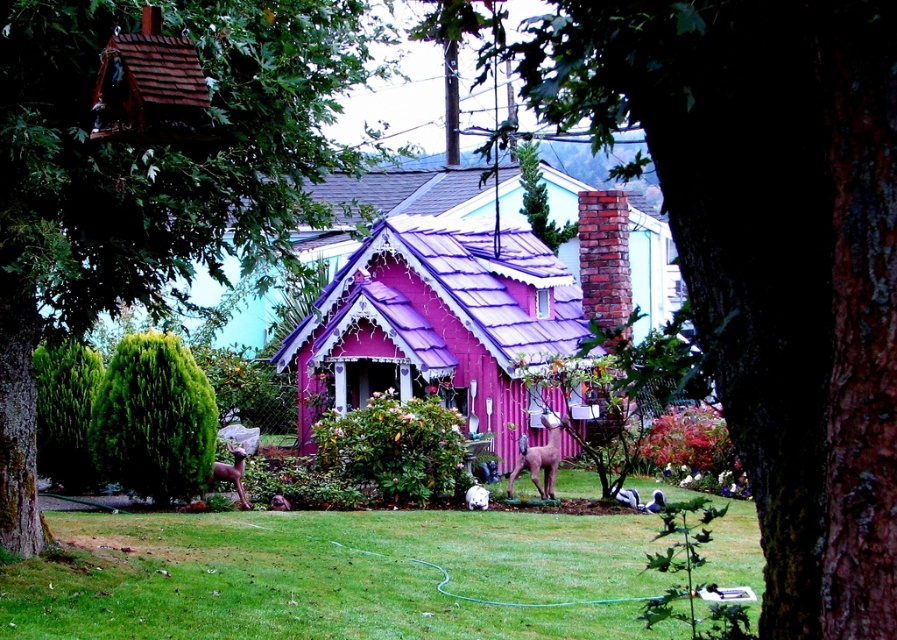
From the picture: Is purple matte tree at center positioned at the back of green leafy tree at center?

No, it is in front of green leafy tree at center.

Between point (837, 536) and point (10, 288), which one is positioned in front?

Point (837, 536) is in front.

Find the location of a particular element. purple matte tree at center is located at coordinates (771, 253).

Who is shorter, green leafy tree at center or brown matte statue at lower center?

brown matte statue at lower center is shorter.

Does point (25, 145) come farther from viewer compared to point (224, 472)?

No, (25, 145) is in front of (224, 472).

Image resolution: width=897 pixels, height=640 pixels. I want to click on green leafy tree at center, so click(x=150, y=168).

What do you see at coordinates (771, 253) in the screenshot?
I see `purple matte tree at center` at bounding box center [771, 253].

Does point (716, 339) come farther from viewer compared to point (475, 252)?

No, (716, 339) is in front of (475, 252).

Where is `purple matte tree at center`? purple matte tree at center is located at coordinates (771, 253).